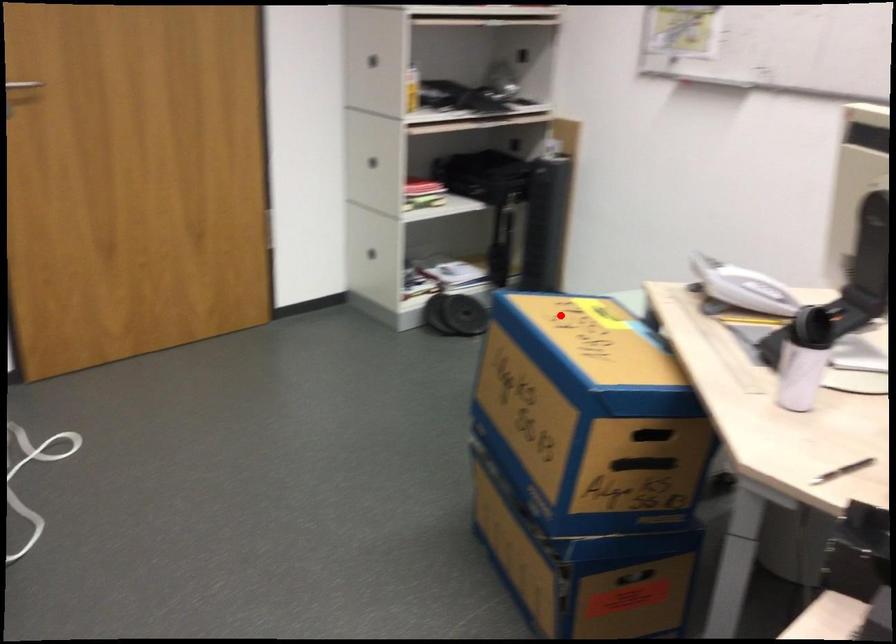
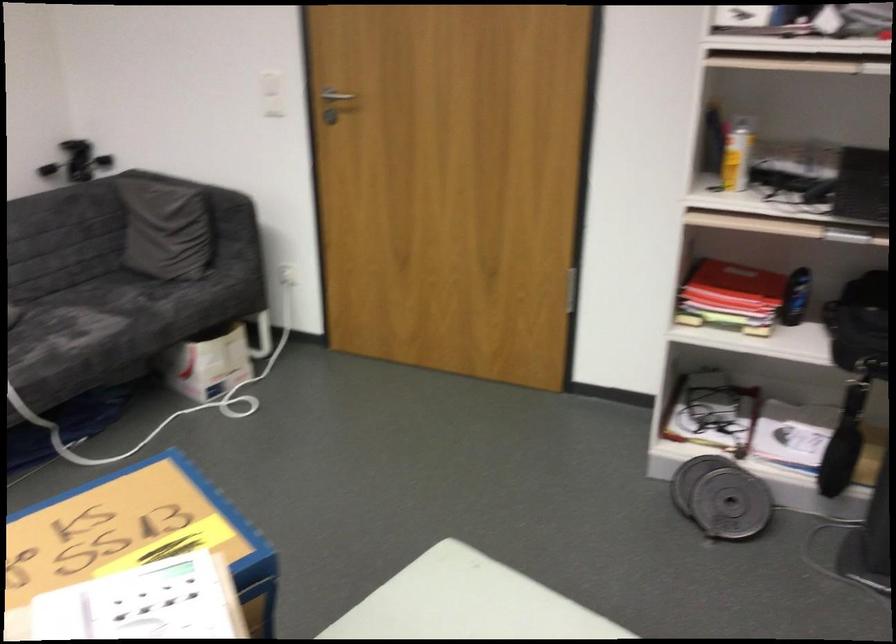
Question: A red point is marked in image1. In image2, is the corresponding 3D point closer to the camera or farther? Reply with the corresponding letter.

Choices:
 (A) The corresponding 3D point is closer.
 (B) The corresponding 3D point is farther.

Answer: (A)